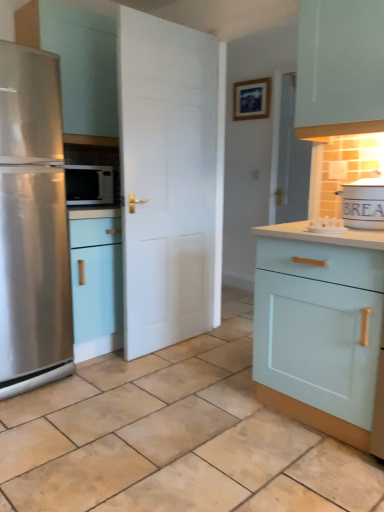
In order to click on vacant region under white matte door at center (from a real-world perspective) in this screenshot , I will do `click(168, 347)`.